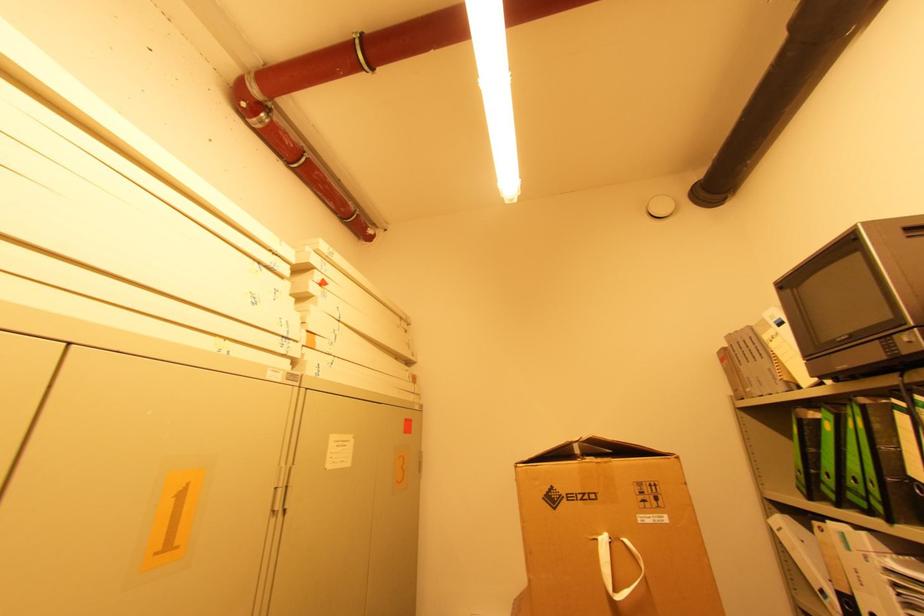
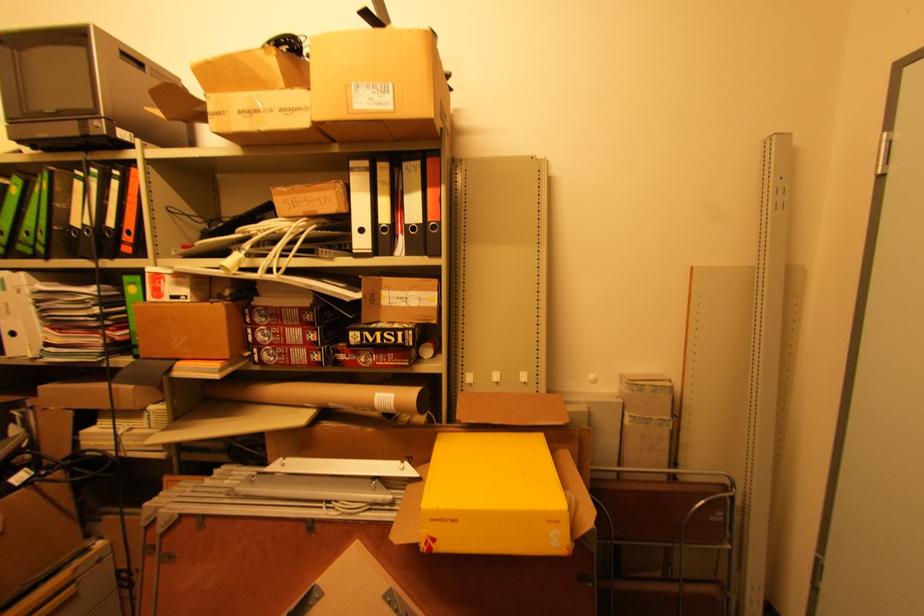
Question: The images are taken continuously from a first-person perspective. In which direction is your viewpoint rotating?

Choices:
 (A) Left
 (B) Right
 (C) Up
 (D) Down

Answer: (B)